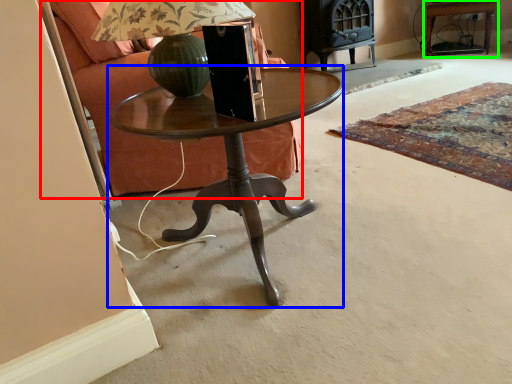
Question: Based on their relative distances, which object is nearer to armchair (highlighted by a red box)? Choose from coffee table (highlighted by a blue box) and side table (highlighted by a green box).

Choices:
 (A) coffee table
 (B) side table

Answer: (A)